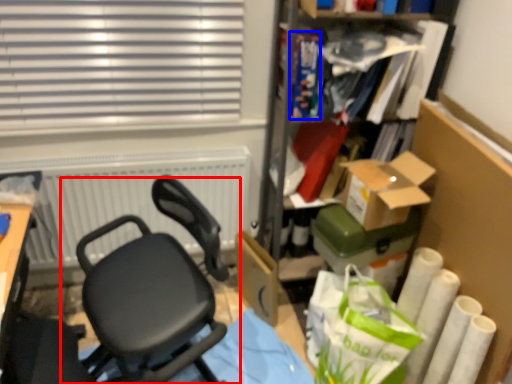
Question: Which of the following is the farthest to the observer, chair (highlighted by a red box) or book (highlighted by a blue box)?

Choices:
 (A) chair
 (B) book

Answer: (B)